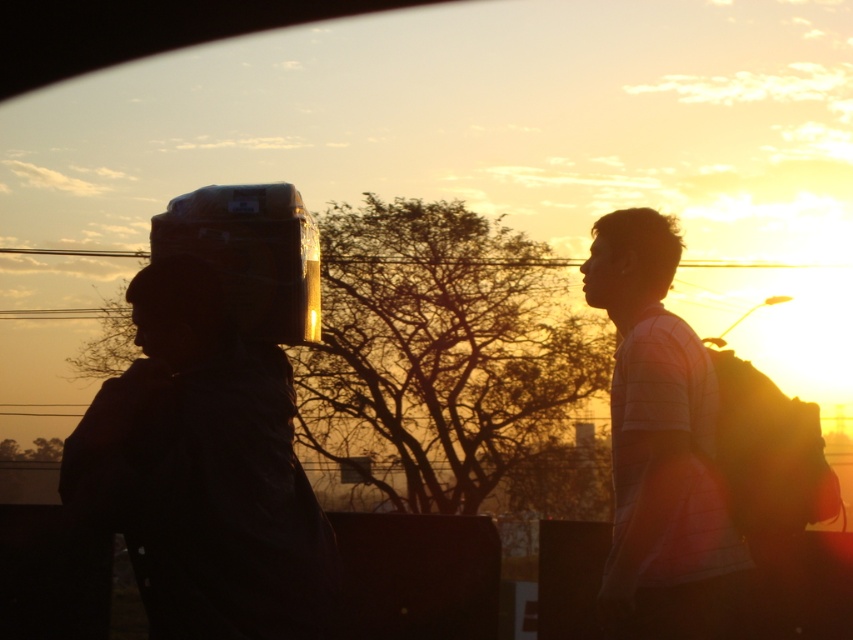
Does matte black helmet at left have a lesser width compared to white striped shirt at right?

No, matte black helmet at left is not thinner than white striped shirt at right.

Can you confirm if matte black helmet at left is taller than white striped shirt at right?

No, matte black helmet at left is not taller than white striped shirt at right.

Which is behind, point (67, 493) or point (722, 516)?

The point (722, 516) is more distant.

I want to click on matte black helmet at left, so (x=204, y=472).